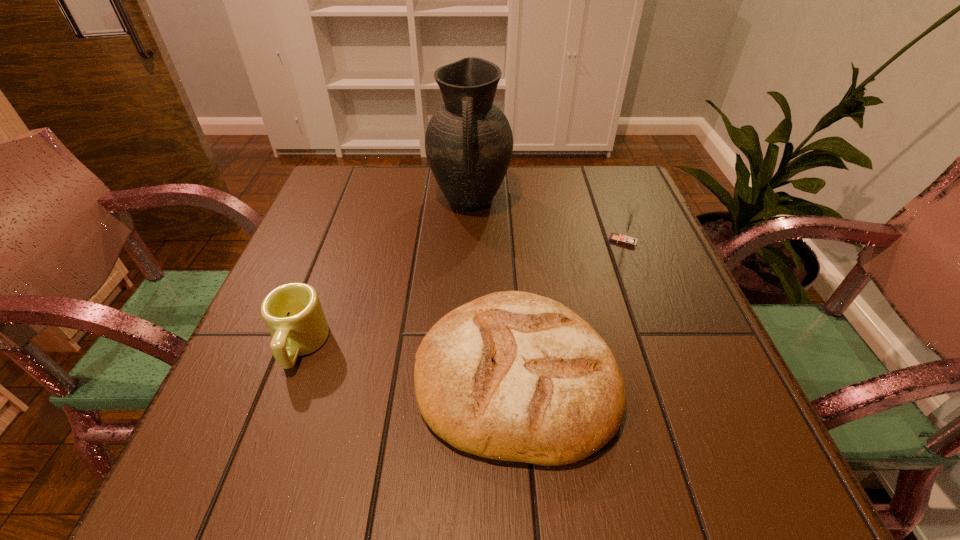
Find the location of a particular element. This screenshot has width=960, height=540. vacant region at the far right corner of the desktop is located at coordinates (596, 165).

This screenshot has height=540, width=960. In order to click on vacant point located between the leftmost object and the bread in this screenshot , I will do `click(409, 361)`.

The height and width of the screenshot is (540, 960). Find the location of `free spot between the leftmost object and the matchbox`. free spot between the leftmost object and the matchbox is located at coordinates (462, 293).

Locate an element on the screen. The width and height of the screenshot is (960, 540). empty space that is in between the rightmost object and the mug is located at coordinates (462, 293).

This screenshot has height=540, width=960. Find the location of `vacant area that lies between the rightmost object and the bread`. vacant area that lies between the rightmost object and the bread is located at coordinates (570, 309).

This screenshot has height=540, width=960. I want to click on vacant area between the bread and the mug, so click(409, 361).

What are the coordinates of `free spot between the rightmost object and the tallest object` in the screenshot? It's located at (546, 221).

Find the location of a particular element. Image resolution: width=960 pixels, height=540 pixels. free space between the rightmost object and the bread is located at coordinates (570, 309).

You are a GUI agent. You are given a task and a screenshot of the screen. Output one action in this format:
    pyautogui.click(x=<x>, y=<y>)
    Task: Click on the free space between the tallest object and the matchbox
    This screenshot has width=960, height=540.
    Given the screenshot: What is the action you would take?
    (546, 221)

Find the location of a particular element. free space between the rightmost object and the pitcher is located at coordinates (546, 221).